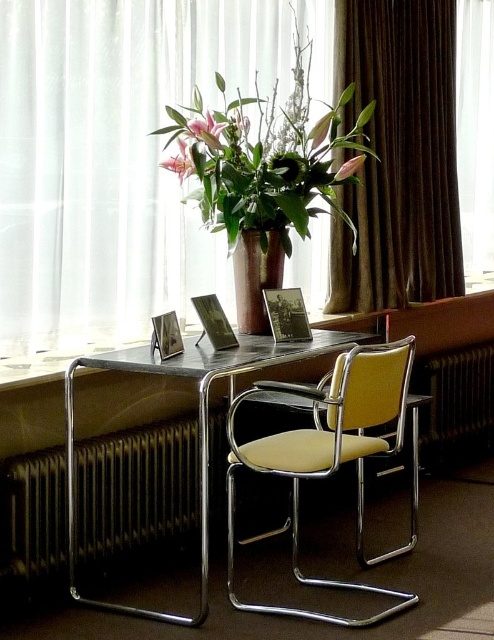
Between brown velvet curtain at right and matte brown vase at center, which one is positioned lower?

matte brown vase at center is below.

Which is more to the left, brown velvet curtain at right or matte brown vase at center?

From the viewer's perspective, matte brown vase at center appears more on the left side.

The height and width of the screenshot is (640, 494). What are the coordinates of `brown velvet curtain at right` in the screenshot? It's located at (399, 156).

At what (x,y) coordinates should I click in order to perform the action: click on brown velvet curtain at right. Please return your answer as a coordinate pair (x, y). This screenshot has width=494, height=640. Looking at the image, I should click on (399, 156).

Does beige leather swivel chair at center have a greater width compared to transparent glass window at upper center?

Yes, beige leather swivel chair at center is wider than transparent glass window at upper center.

Does beige leather swivel chair at center have a lesser height compared to transparent glass window at upper center?

Correct, beige leather swivel chair at center is not as tall as transparent glass window at upper center.

Who is more forward, (291, 532) or (484, 204)?

Point (291, 532) is in front.

This screenshot has height=640, width=494. In order to click on beige leather swivel chair at center in this screenshot , I will do `click(328, 451)`.

The width and height of the screenshot is (494, 640). What do you see at coordinates (399, 156) in the screenshot? I see `brown velvet curtain at right` at bounding box center [399, 156].

Locate an element on the screen. This screenshot has height=640, width=494. brown velvet curtain at right is located at coordinates (399, 156).

Is point (453, 131) positioned behind point (298, 349)?

Yes, it is.

This screenshot has width=494, height=640. Find the location of `brown velvet curtain at right`. brown velvet curtain at right is located at coordinates click(399, 156).